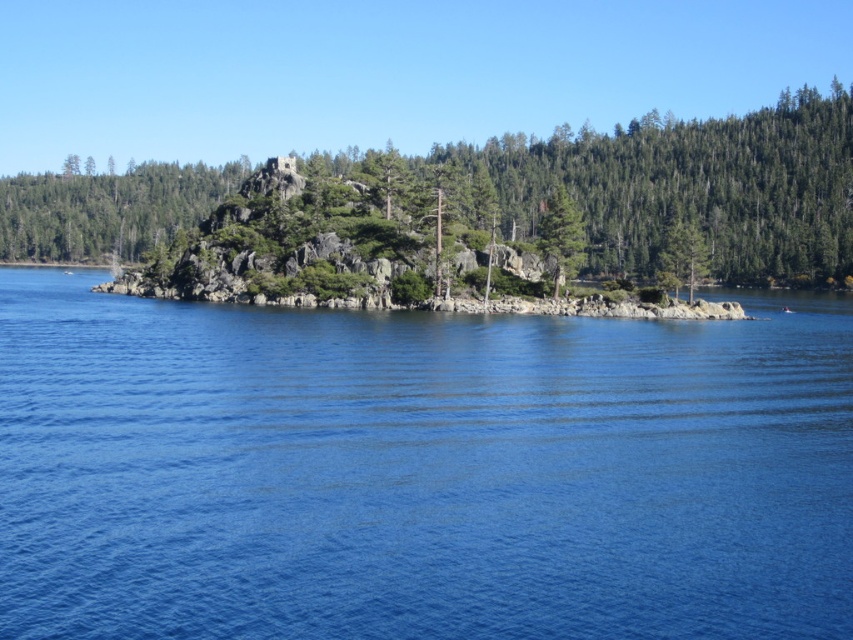
Does blue water at center have a greater width compared to green textured rock at center?

No, blue water at center is not wider than green textured rock at center.

This screenshot has height=640, width=853. In order to click on blue water at center in this screenshot , I will do `click(419, 470)`.

This screenshot has width=853, height=640. What do you see at coordinates (419, 470) in the screenshot?
I see `blue water at center` at bounding box center [419, 470].

Which is more to the left, blue water at center or green matte tree at center?

blue water at center is more to the left.

Between point (759, 307) and point (553, 240), which one is positioned behind?

The point (759, 307) is behind.

Find the location of a particular element. This screenshot has width=853, height=640. blue water at center is located at coordinates (419, 470).

In the scene shown: Who is more distant from viewer, (79, 240) or (688, 276)?

Point (79, 240)

This screenshot has width=853, height=640. What do you see at coordinates (692, 188) in the screenshot?
I see `green textured rock at center` at bounding box center [692, 188].

Is point (727, 272) farther from camera compared to point (664, 269)?

Yes, point (727, 272) is behind point (664, 269).

In order to click on green textured rock at center in this screenshot , I will do `click(692, 188)`.